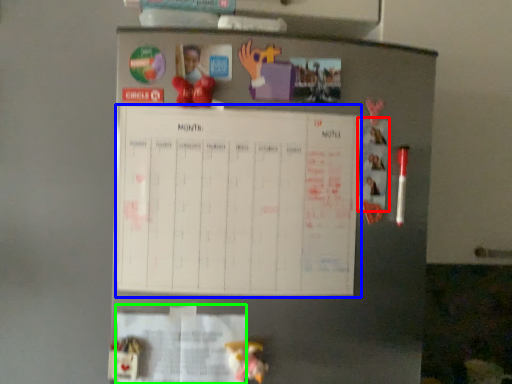
Question: Based on their relative distances, which object is farther from poster (highlighted by a red box)? Choose from bulletin board (highlighted by a blue box) and paper (highlighted by a green box).

Choices:
 (A) bulletin board
 (B) paper

Answer: (B)